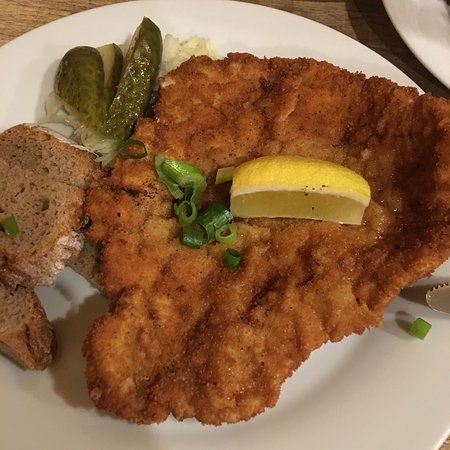
This screenshot has height=450, width=450. What are the coordinates of `plate` in the screenshot? It's located at (353, 357), (426, 47).